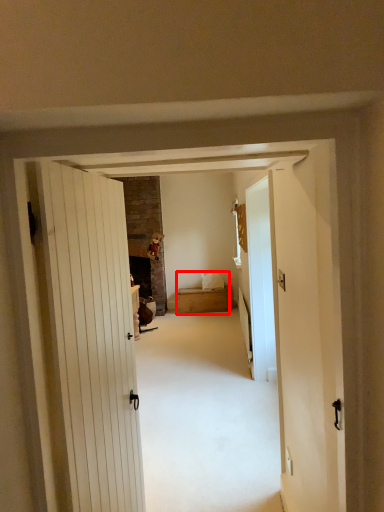
Question: From the image's perspective, where is bed (annotated by the red box) located relative to glass door?

Choices:
 (A) above
 (B) below

Answer: (B)